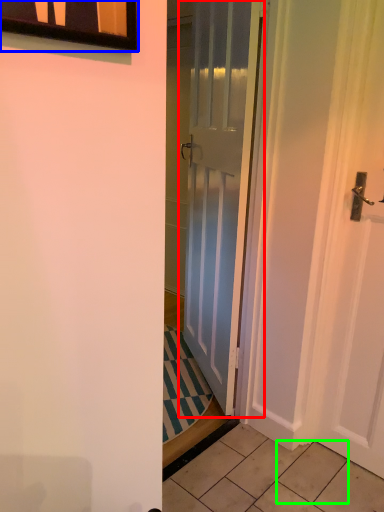
Question: Which object is positioned farthest from door (highlighted by a red box)? Select from window (highlighted by a blue box) and tile (highlighted by a green box).

Choices:
 (A) window
 (B) tile

Answer: (A)